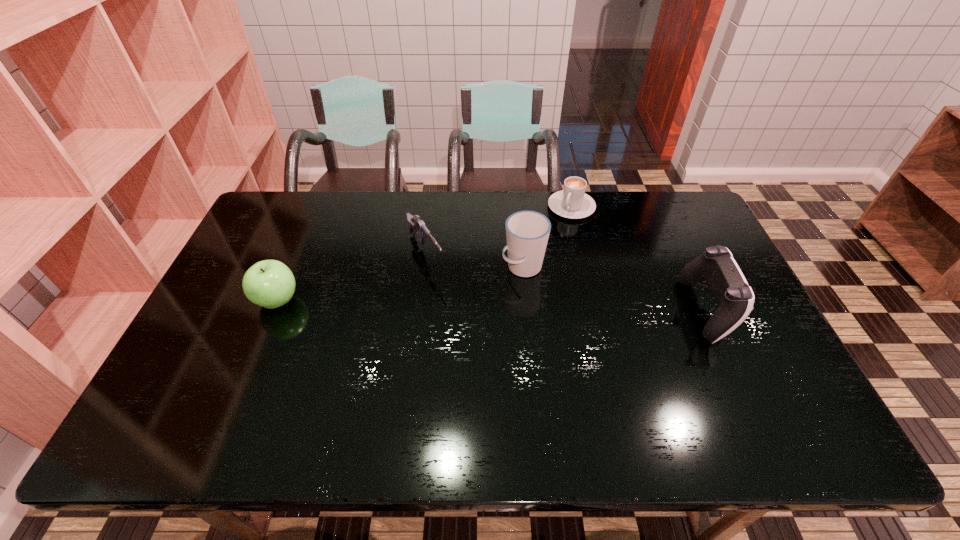
Locate an element on the screen. apple is located at coordinates (270, 284).

In order to click on control in this screenshot , I will do `click(734, 297)`.

You are a GUI agent. You are given a task and a screenshot of the screen. Output one action in this format:
    pyautogui.click(x=<x>, y=<y>)
    Task: Click on the gun
    Image resolution: width=960 pixels, height=540 pixels.
    Given the screenshot: What is the action you would take?
    pyautogui.click(x=417, y=227)

Find the location of `the farthest object`. the farthest object is located at coordinates (572, 202).

Identify the location of the second object from right to left. (572, 202).

Where is `the third object from right to left`? the third object from right to left is located at coordinates (527, 232).

The width and height of the screenshot is (960, 540). Find the location of `blank area located on the right of the leftmost object`. blank area located on the right of the leftmost object is located at coordinates (417, 301).

Where is `vacant space situated at the barrel of the gun`? vacant space situated at the barrel of the gun is located at coordinates (464, 320).

The height and width of the screenshot is (540, 960). What are the coordinates of `vacant space situated 0.170m at the barrel of the gun` in the screenshot? It's located at (460, 315).

What are the coordinates of `free location located at the barrel of the gun` in the screenshot? It's located at (476, 338).